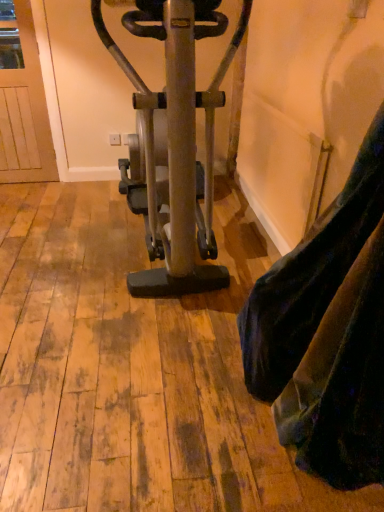
Where is `space that is in front of metallic gold stationary bicycle at center`? This screenshot has height=512, width=384. space that is in front of metallic gold stationary bicycle at center is located at coordinates (105, 369).